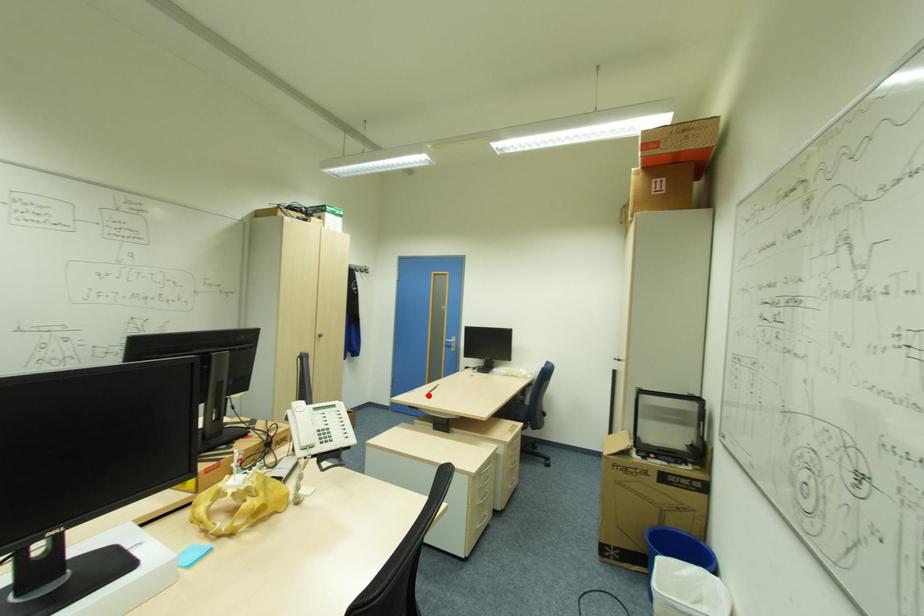
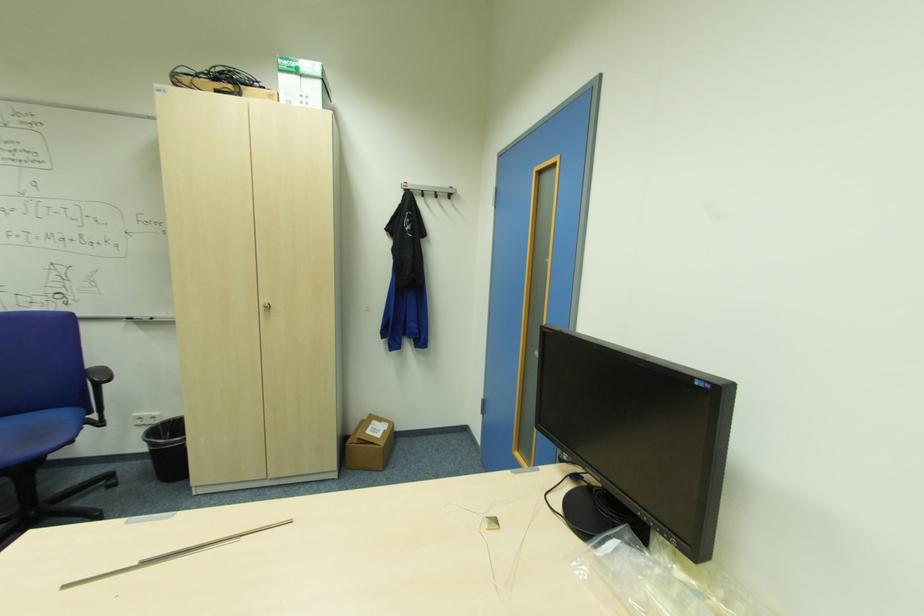
Question: I am providing you with two images of the same scene from different viewpoints. Image1 has a red point marked. In image2, the corresponding 3D location appears at what relative position? Reply with the corresponding letter.

Choices:
 (A) Closer
 (B) Farther

Answer: (A)